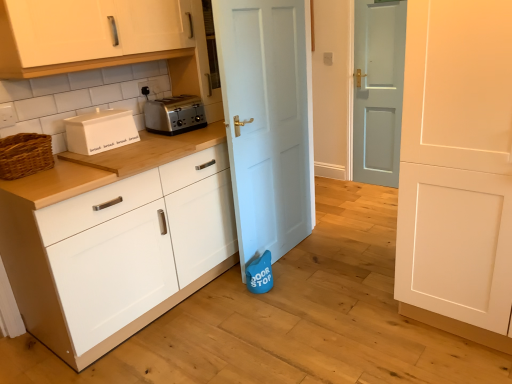
Where is `vacant space situated on the left part of white matte door at right, marked as the third door in a back-to-front arrangement`? This screenshot has width=512, height=384. vacant space situated on the left part of white matte door at right, marked as the third door in a back-to-front arrangement is located at coordinates (359, 313).